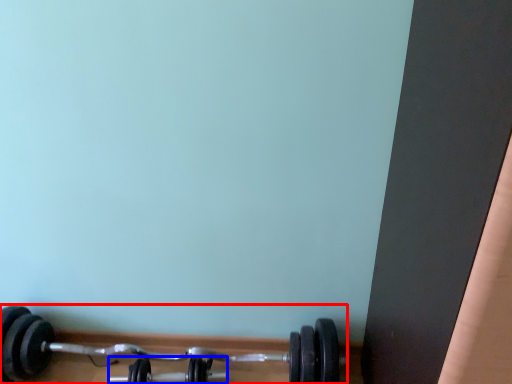
Question: Among these objects, which one is nearest to the camera, dumbbell (highlighted by a red box) or dumbbell (highlighted by a blue box)?

Choices:
 (A) dumbbell
 (B) dumbbell

Answer: (A)